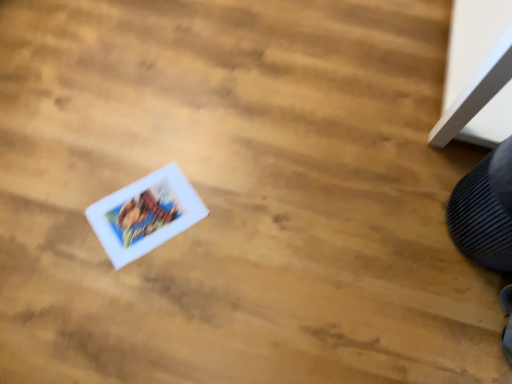
Where is `free point to the left of black textured shoe at lower right`? free point to the left of black textured shoe at lower right is located at coordinates (395, 212).